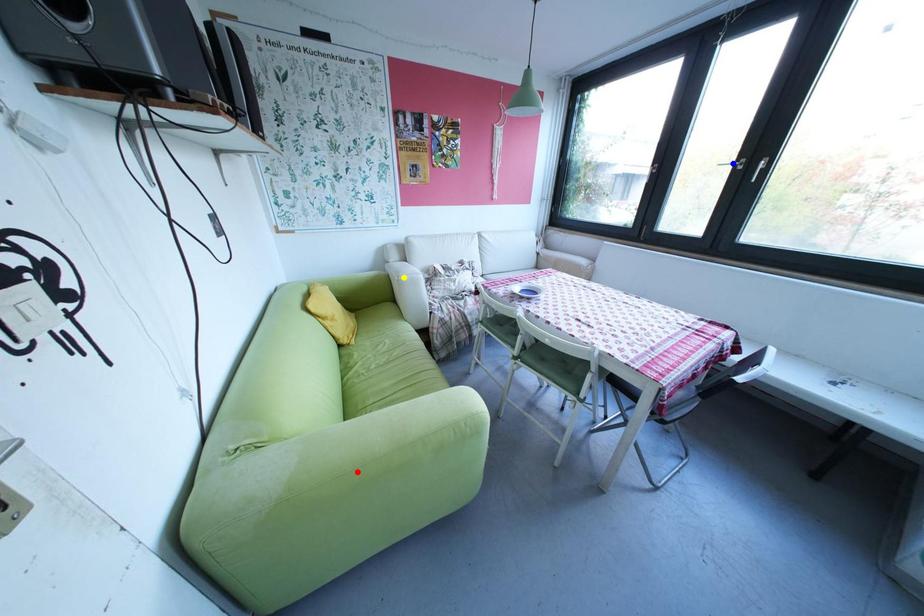
Order these from nearest to farthest:
A) yellow point
B) blue point
C) red point

yellow point
blue point
red point